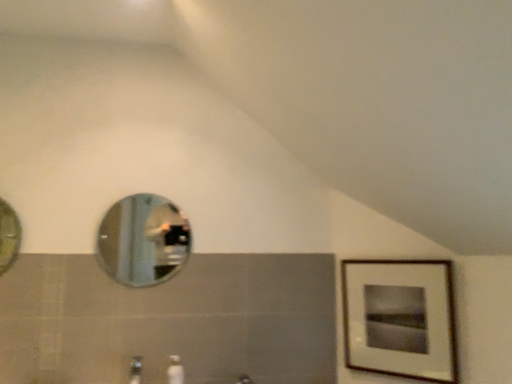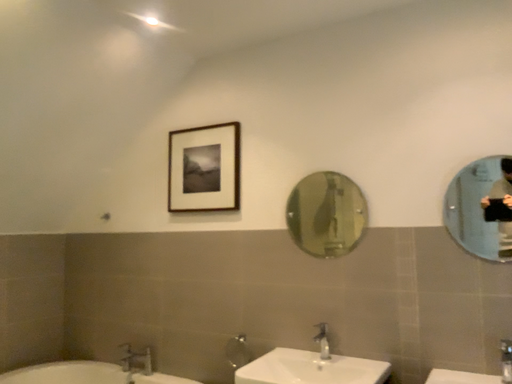
Question: How did the camera likely rotate when shooting the video?

Choices:
 (A) rotated right
 (B) rotated left

Answer: (B)